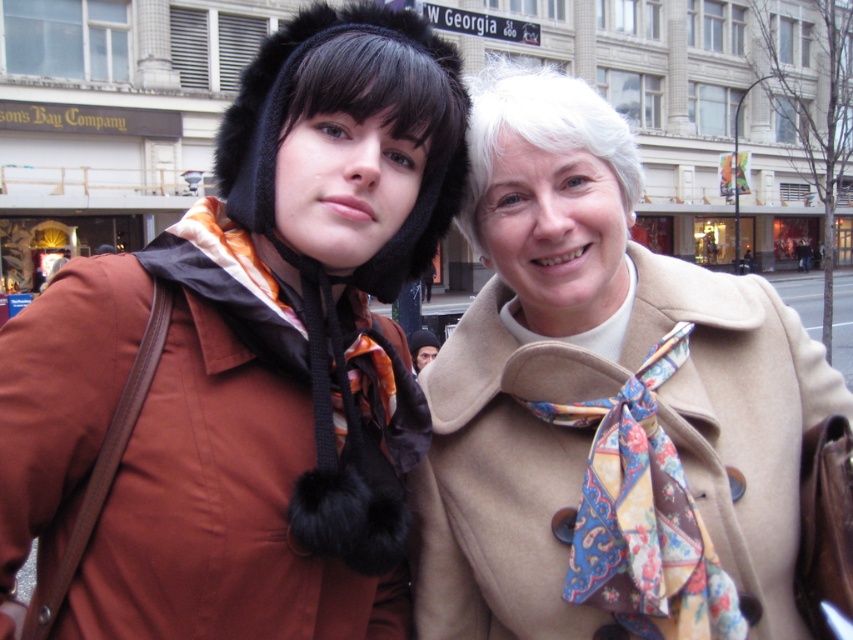
Locate an element on the screen. The width and height of the screenshot is (853, 640). paisley silk scarf at center is located at coordinates (642, 515).

Does paisley silk scarf at center have a greater width compared to fuzzy black hat at center?

Incorrect, paisley silk scarf at center's width does not surpass fuzzy black hat at center's.

Which is in front, point (685, 580) or point (339, 19)?

Point (685, 580) is more forward.

The width and height of the screenshot is (853, 640). I want to click on paisley silk scarf at center, so click(x=642, y=515).

Identify the location of paisley silk scarf at center. Image resolution: width=853 pixels, height=640 pixels. (642, 515).

Is paisley silk scarf at center bigger than dark brown leather jacket at center?

Indeed, paisley silk scarf at center has a larger size compared to dark brown leather jacket at center.

Who is more distant from viewer, (637, 518) or (425, 349)?

The point (425, 349) is behind.

At what (x,y) coordinates should I click in order to perform the action: click on paisley silk scarf at center. Please return your answer as a coordinate pair (x, y). Looking at the image, I should click on (642, 515).

Does fuzzy black hat at center have a greater height compared to dark brown leather jacket at center?

Indeed, fuzzy black hat at center has a greater height compared to dark brown leather jacket at center.

Can you confirm if fuzzy black hat at center is smaller than dark brown leather jacket at center?

Actually, fuzzy black hat at center might be larger than dark brown leather jacket at center.

Describe the element at coordinates (289, 77) in the screenshot. This screenshot has height=640, width=853. I see `fuzzy black hat at center` at that location.

The image size is (853, 640). In order to click on fuzzy black hat at center in this screenshot , I will do `click(289, 77)`.